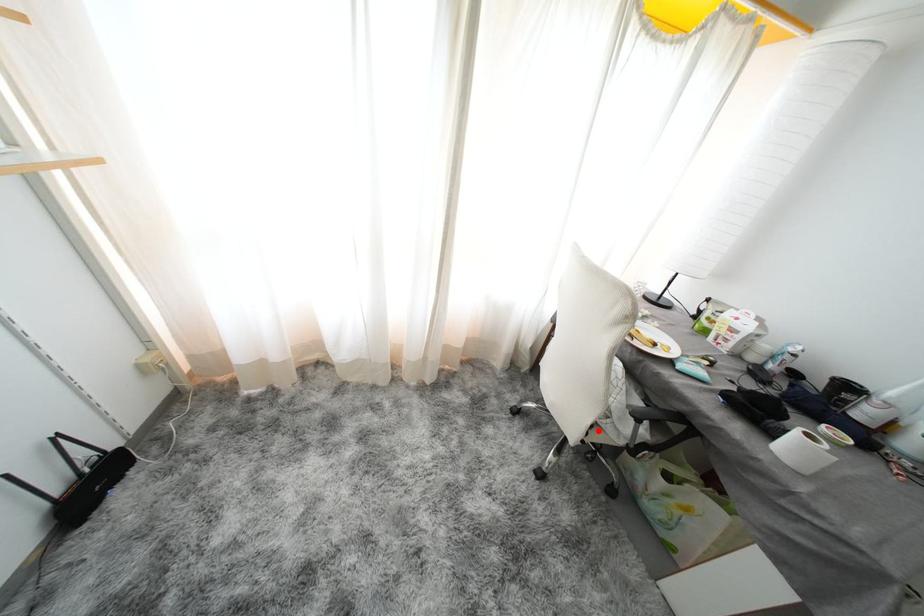
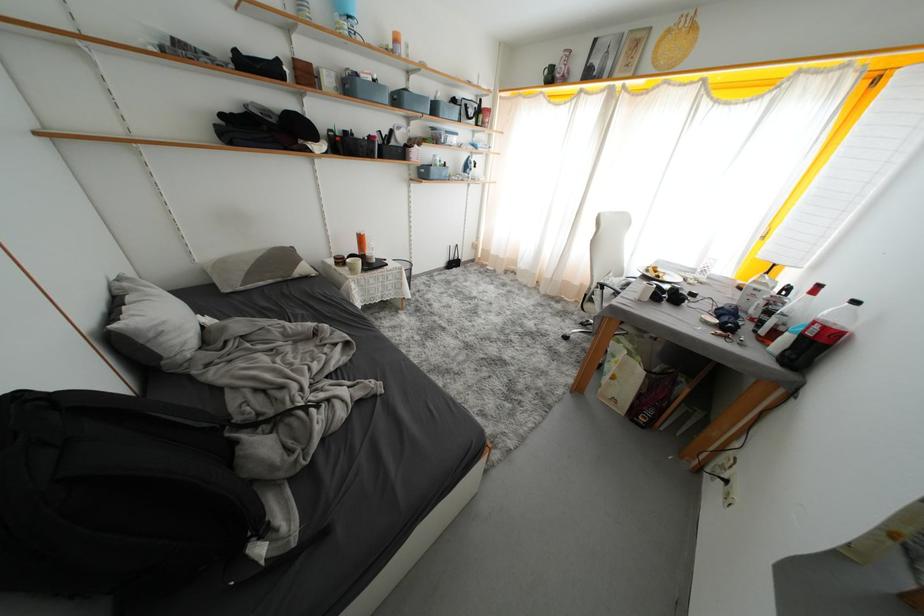
Locate, in the second image, the point that corresponds to the highlighted location in the first image.

(591, 299)